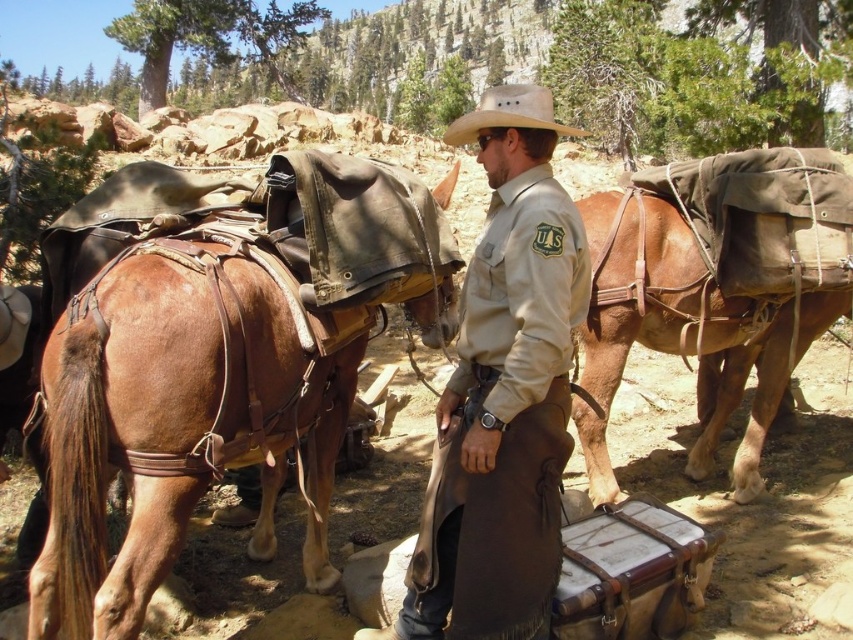
You are a hiker trying to navigate through the mountain path. You see two points marked on your map. The first point is at coordinate point(561, 371) and the second point is at coordinate point(509, 108). According to the scene, which point is closer to you?

Point(509, 108) is closer to you because it is in front of point(561, 371).

You are a hiker planning to cross a narrow mountain path that can only accommodate one horse at a time. You have to lead both the brown leather saddle at left and the brown leather saddle at center across. Given their positions, which saddle should you move first to ensure you can navigate the path safely?

The brown leather saddle at left should be moved first since it is farther away from the brown leather saddle at center by 3.18 meters. This distance allows you to maneuver each horse individually without them getting too close on the narrow path.